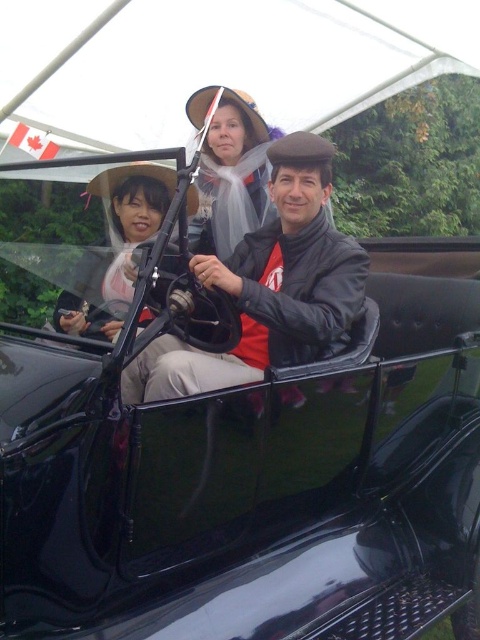
You are a photographer trying to capture the scene of the vintage car with its passengers. You notice the white fabric canopy at upper center and the matte white veil at center. Which object should you focus on first if you want to highlight the larger one in your photo?

The white fabric canopy at upper center is larger in size than the matte white veil at center, so you should focus on the white fabric canopy at upper center first to highlight the larger object.